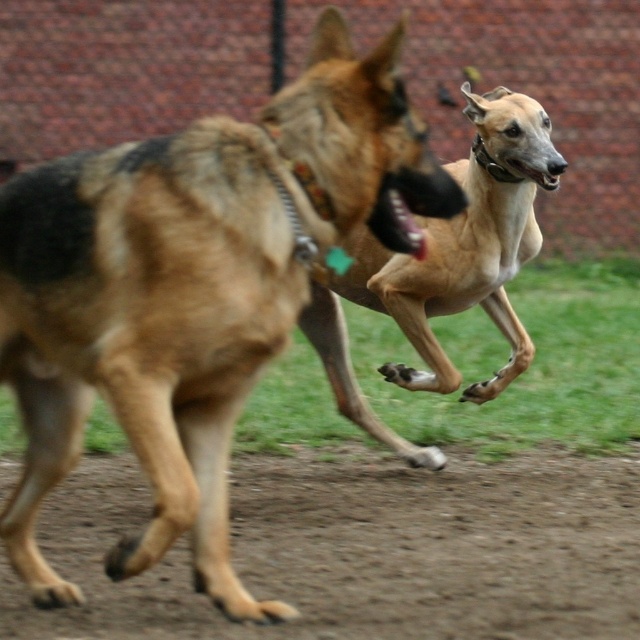
Question: Observing the image, what is the correct spatial positioning of brown fur dog at center in reference to black glossy teeth at center?

Choices:
 (A) below
 (B) above

Answer: (A)

Question: Which is nearer to the light brown smooth dog at center?

Choices:
 (A) brown fur dog at center
 (B) black glossy teeth at center
 (C) brown dirt track at lower center

Answer: (C)

Question: Does brown fur dog at center lie in front of brown dirt track at lower center?

Choices:
 (A) no
 (B) yes

Answer: (B)

Question: Which object is farther from the camera taking this photo?

Choices:
 (A) brown dirt track at lower center
 (B) brown fur dog at center
 (C) black glossy teeth at center

Answer: (A)

Question: Which of the following is the farthest from the observer?

Choices:
 (A) brown dirt track at lower center
 (B) black glossy teeth at center
 (C) light brown smooth dog at center

Answer: (C)

Question: Considering the relative positions of brown dirt track at lower center and light brown smooth dog at center in the image provided, where is brown dirt track at lower center located with respect to light brown smooth dog at center?

Choices:
 (A) left
 (B) right

Answer: (A)